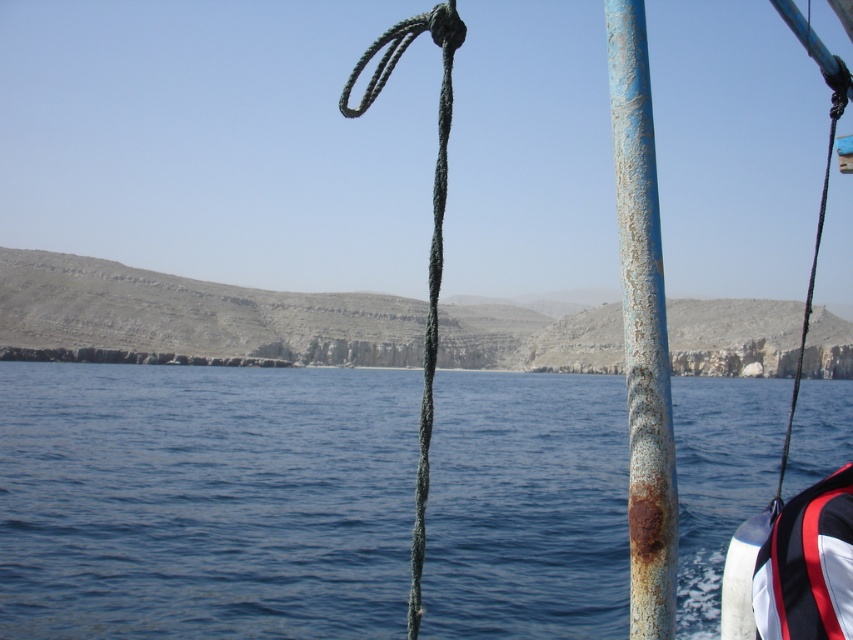
Question: Which object is the farthest from the rusty metal pole at right?

Choices:
 (A) blue water at center
 (B) white/red fabric life jacket at lower right
 (C) green rough rope at center
 (D) green rope at right

Answer: (D)

Question: Which point appears closest to the camera in this image?

Choices:
 (A) (431, 312)
 (B) (815, 497)

Answer: (A)

Question: Does green rough rope at center have a lesser width compared to green rope at right?

Choices:
 (A) yes
 (B) no

Answer: (A)

Question: Is rusty metal pole at right smaller than white/red fabric life jacket at lower right?

Choices:
 (A) yes
 (B) no

Answer: (B)

Question: Does rusty metal pole at right have a larger size compared to green rope at right?

Choices:
 (A) no
 (B) yes

Answer: (A)

Question: Which object appears closest to the camera in this image?

Choices:
 (A) blue water at center
 (B) rusty metal pole at right

Answer: (B)